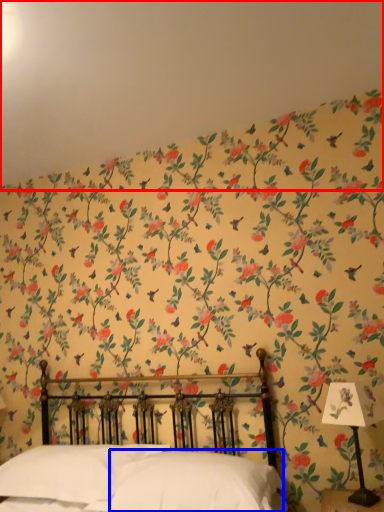
Question: Which of the following is the farthest to the observer, backdrop (highlighted by a red box) or pillow (highlighted by a blue box)?

Choices:
 (A) backdrop
 (B) pillow

Answer: (B)